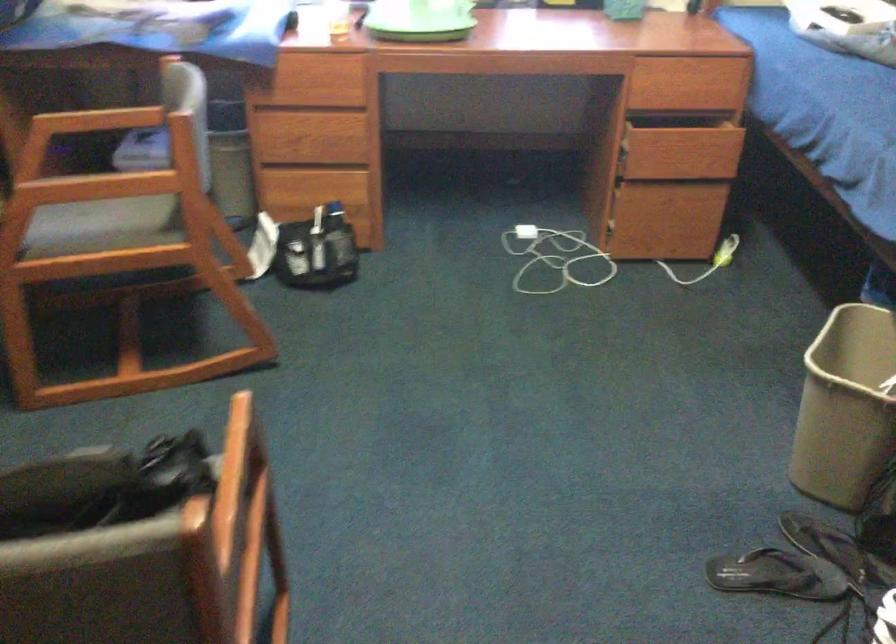
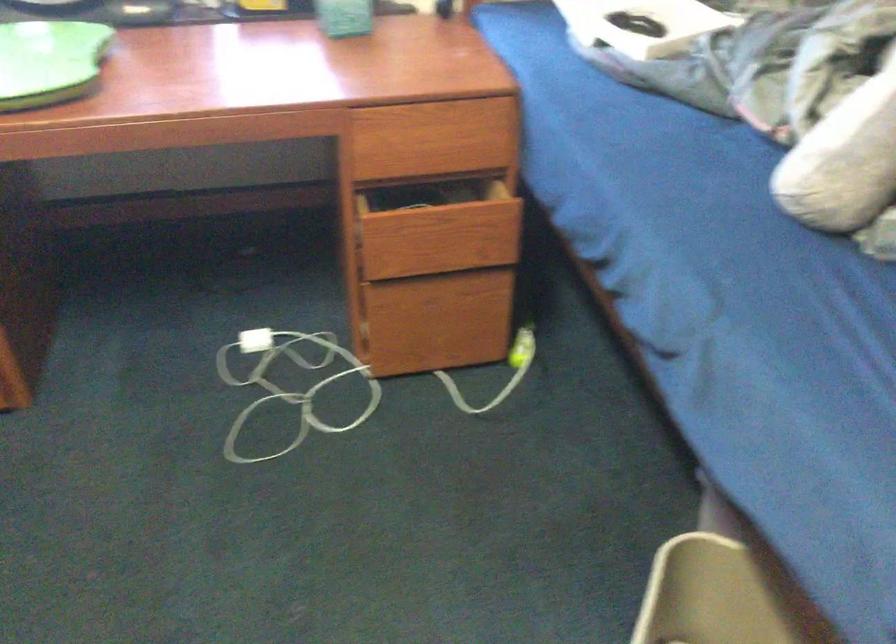
In the second image, find the point that corresponds to [547,261] in the first image.

(289, 383)